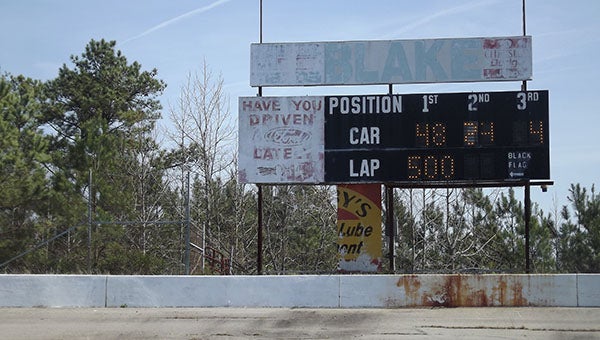
Image resolution: width=600 pixels, height=340 pixels. I want to click on wall, so click(237, 292).